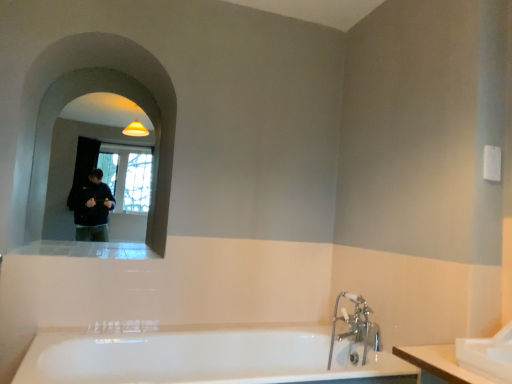
Question: Can you see white glossy bathtub at lower center touching chrome metallic faucet at lower right?

Choices:
 (A) no
 (B) yes

Answer: (A)

Question: Does white glossy bathtub at lower center come in front of chrome metallic faucet at lower right?

Choices:
 (A) yes
 (B) no

Answer: (A)

Question: Is white glossy bathtub at lower center looking in the opposite direction of chrome metallic faucet at lower right?

Choices:
 (A) yes
 (B) no

Answer: (B)

Question: From a real-world perspective, is white glossy bathtub at lower center located higher than chrome metallic faucet at lower right?

Choices:
 (A) no
 (B) yes

Answer: (A)

Question: Could chrome metallic faucet at lower right be considered to be inside white glossy bathtub at lower center?

Choices:
 (A) yes
 (B) no

Answer: (A)

Question: Can you confirm if white glossy bathtub at lower center is smaller than chrome metallic faucet at lower right?

Choices:
 (A) no
 (B) yes

Answer: (A)

Question: Considering the relative sizes of matte glass mirror at upper left and white glossy bathtub at lower center in the image provided, is matte glass mirror at upper left smaller than white glossy bathtub at lower center?

Choices:
 (A) yes
 (B) no

Answer: (B)

Question: Can white glossy bathtub at lower center be found inside matte glass mirror at upper left?

Choices:
 (A) no
 (B) yes

Answer: (A)

Question: Is matte glass mirror at upper left turned away from white glossy bathtub at lower center?

Choices:
 (A) no
 (B) yes

Answer: (A)

Question: Does matte glass mirror at upper left appear on the left side of white glossy bathtub at lower center?

Choices:
 (A) yes
 (B) no

Answer: (A)

Question: From the image's perspective, is matte glass mirror at upper left located beneath white glossy bathtub at lower center?

Choices:
 (A) no
 (B) yes

Answer: (A)

Question: Is matte glass mirror at upper left positioned behind white glossy bathtub at lower center?

Choices:
 (A) no
 (B) yes

Answer: (B)

Question: From a real-world perspective, does matte glass mirror at upper left sit lower than chrome metallic faucet at lower right?

Choices:
 (A) yes
 (B) no

Answer: (B)